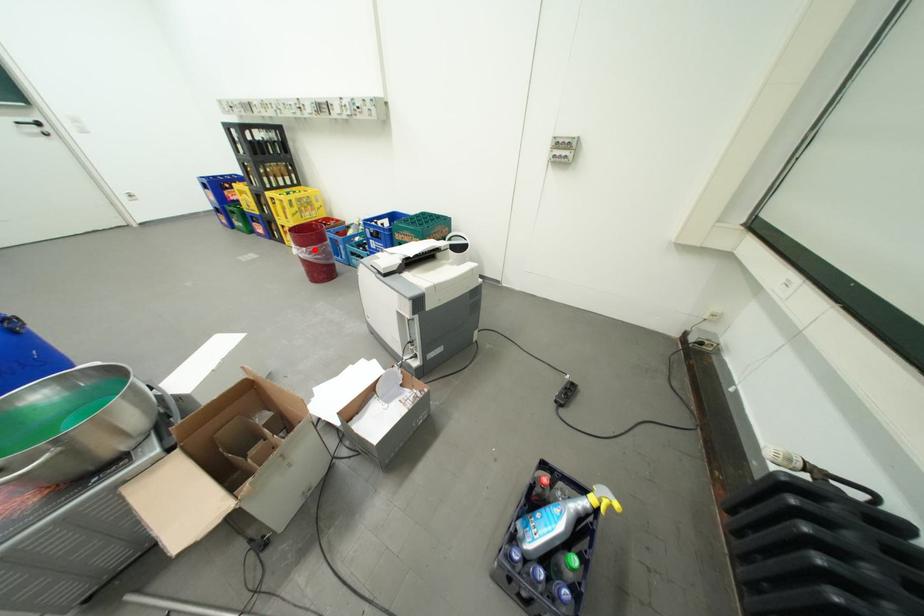
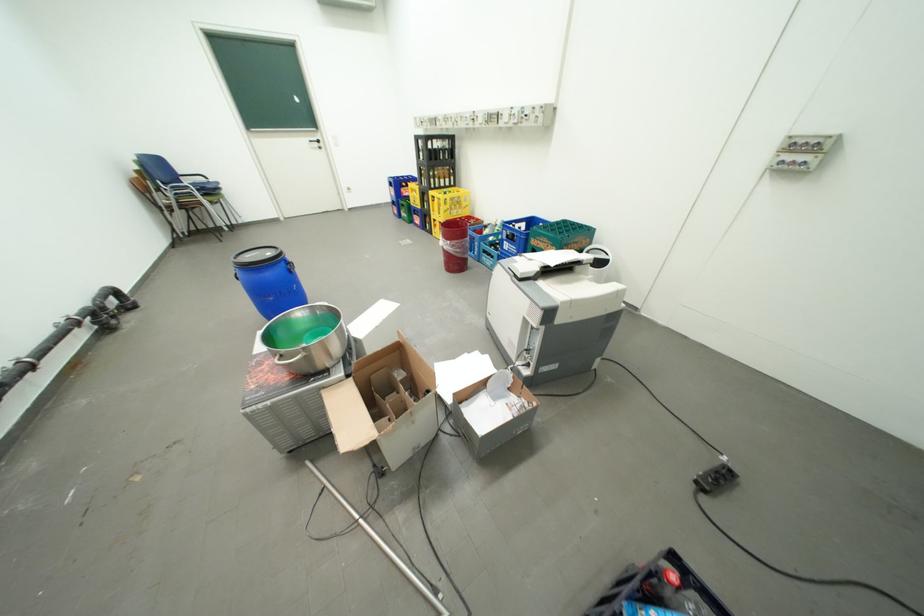
Question: A red point is marked in image1. In image2, is the corresponding 3D point closer to the camera or farther? Reply with the corresponding letter.

Choices:
 (A) The corresponding 3D point is closer.
 (B) The corresponding 3D point is farther.

Answer: (B)